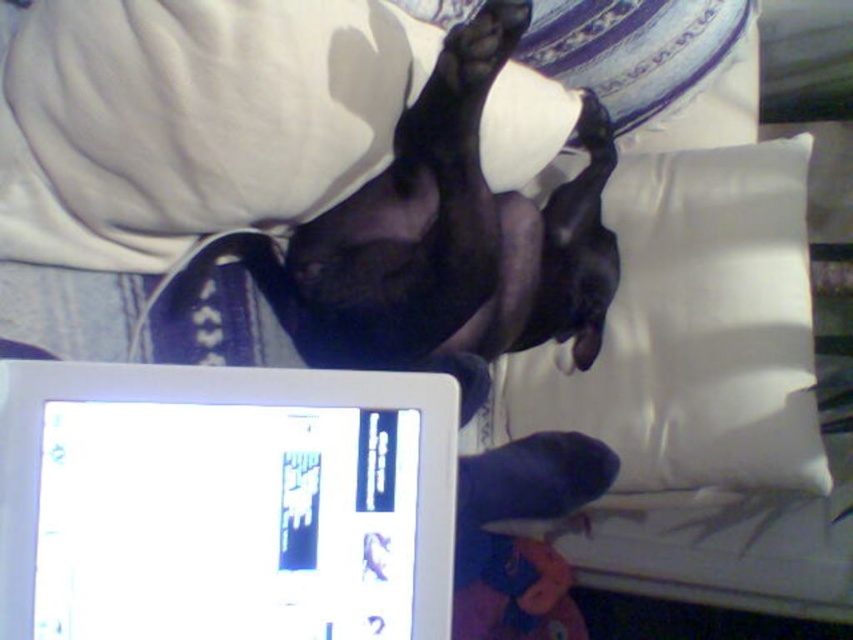
You are designing a layout for a pet photo shoot and want to place a camera at the center of the image. The camera must avoid the area where the satin white pillow at upper right is located. What coordinate should you avoid?

You should avoid the coordinate point at [692,330] where the satin white pillow at upper right is located.

You are trying to take a photo of the black matte paw at upper center. However, the white glossy tablet at lower left is blocking your view. Can you move the tablet to the side to get a clear shot of the paw?

The white glossy tablet at lower left is in front of the black matte paw at upper center, so moving the tablet to the side would allow you to see the black matte paw at upper center clearly.

You are a photographer trying to capture the black smooth dog at center and the satin white pillow at upper right in the frame. Which object should you focus on first if you want to ensure both are in focus without adjusting the camera settings?

The black smooth dog at center should be focused on first because the satin white pillow at upper right is smaller in size, so focusing on the larger object ensures both will be in focus.